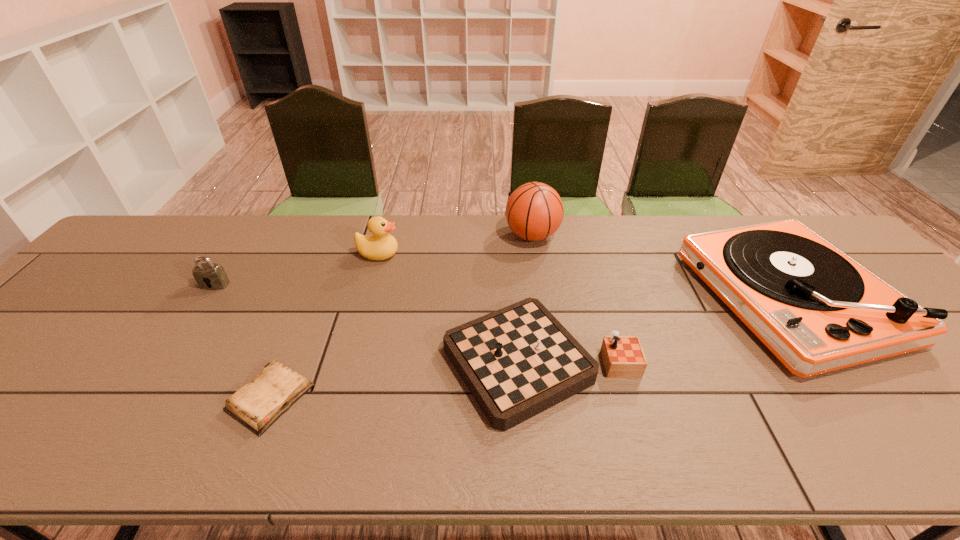
Identify the location of the tallest object. The image size is (960, 540). (534, 211).

You are a GUI agent. You are given a task and a screenshot of the screen. Output one action in this format:
    pyautogui.click(x=<x>, y=<y>)
    Task: Click on the duck
    The width and height of the screenshot is (960, 540).
    Given the screenshot: What is the action you would take?
    pyautogui.click(x=381, y=245)

Image resolution: width=960 pixels, height=540 pixels. I want to click on padlock, so click(209, 276).

Where is `the second shortest object`? This screenshot has height=540, width=960. the second shortest object is located at coordinates (518, 361).

Identify the location of diary. This screenshot has height=540, width=960. (257, 405).

Locate an element on the screen. Image resolution: width=960 pixels, height=540 pixels. vacant space located 0.230m on the right of the basketball is located at coordinates [x=633, y=236].

I want to click on free space located 0.160m at the beak of the duck, so click(452, 254).

Image resolution: width=960 pixels, height=540 pixels. I want to click on vacant area situated 0.390m at the front of the leftmost object near the keyhole, so click(x=125, y=418).

Find the location of `vacant space situated 0.220m on the back of the fifth tallest object`. vacant space situated 0.220m on the back of the fifth tallest object is located at coordinates (527, 258).

Where is `free location located 0.200m on the right of the shortest object`? The image size is (960, 540). free location located 0.200m on the right of the shortest object is located at coordinates (403, 397).